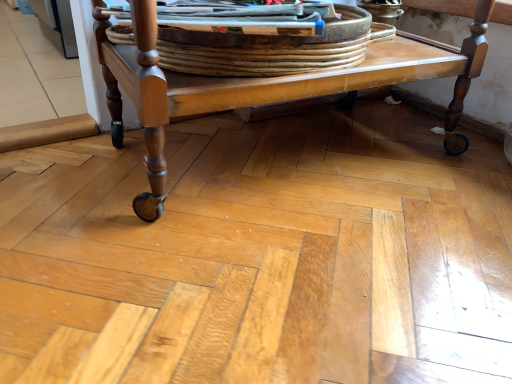
The height and width of the screenshot is (384, 512). Describe the element at coordinates (264, 84) in the screenshot. I see `shiny brown wooden table at center` at that location.

Find the location of a particular element. shiny brown wooden table at center is located at coordinates (264, 84).

Locate an element on the screen. Image resolution: width=512 pixels, height=384 pixels. shiny brown wooden table at center is located at coordinates (264, 84).